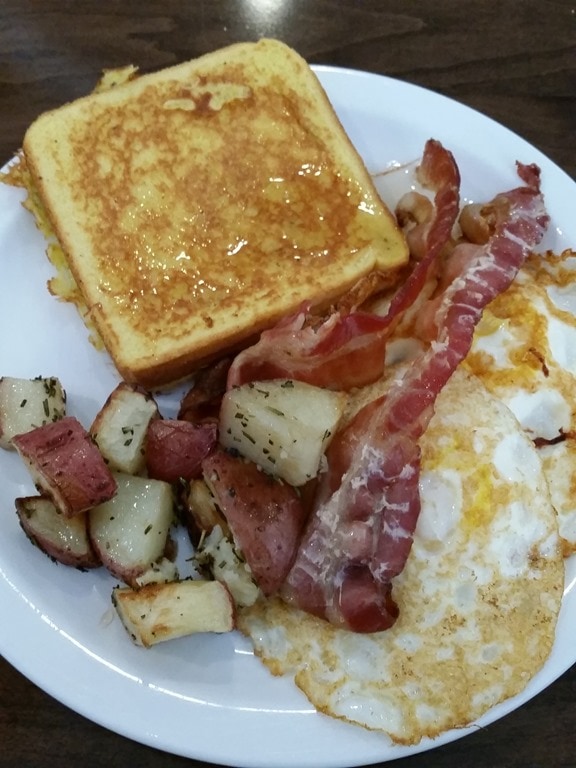
This screenshot has height=768, width=576. Find the location of `tabletop`. tabletop is located at coordinates click(524, 740).